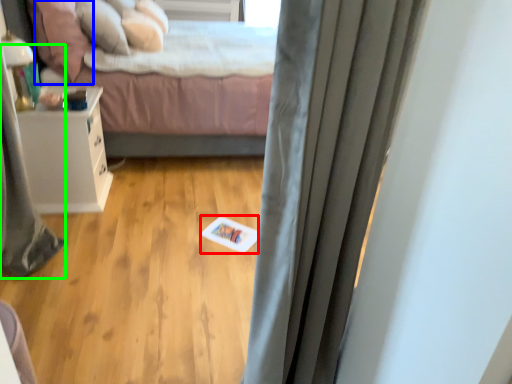
Question: Based on their relative distances, which object is nearer to card (highlighted by a red box)? Choose from pillow (highlighted by a blue box) and shower curtain (highlighted by a green box).

Choices:
 (A) pillow
 (B) shower curtain

Answer: (B)